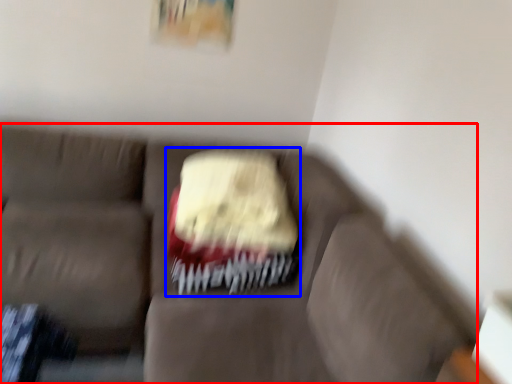
Question: Which point is closer to the camera, studio couch (highlighted by a red box) or cake (highlighted by a blue box)?

Choices:
 (A) studio couch
 (B) cake

Answer: (A)